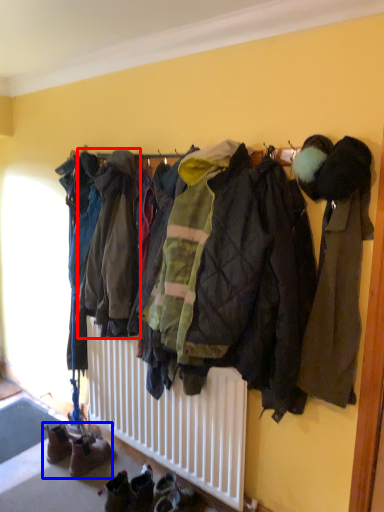
Question: Which of the following is the farthest to the observer, jacket (highlighted by a red box) or footwear (highlighted by a blue box)?

Choices:
 (A) jacket
 (B) footwear

Answer: (B)